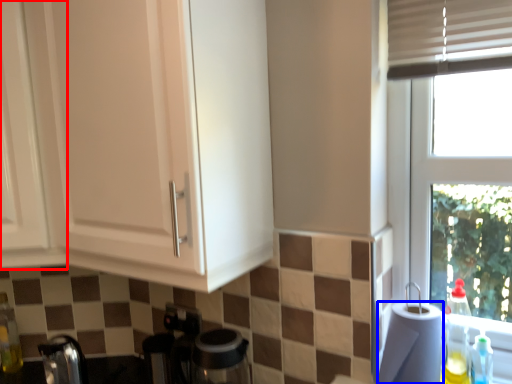
Question: Among these objects, which one is nearest to the camera, cabinetry (highlighted by a red box) or paper towel (highlighted by a blue box)?

Choices:
 (A) cabinetry
 (B) paper towel

Answer: (B)